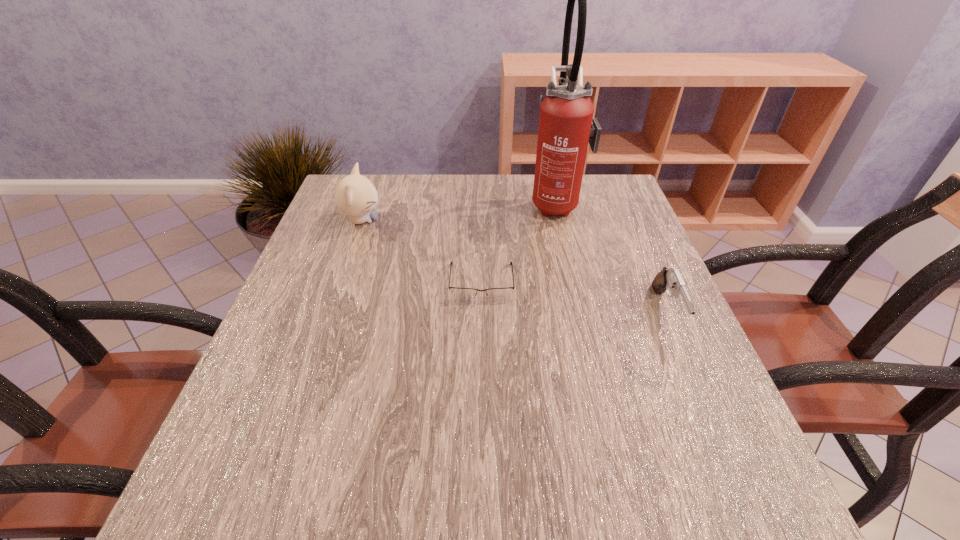
Find the location of `object situated at the far right corner`. object situated at the far right corner is located at coordinates (566, 125).

The width and height of the screenshot is (960, 540). I want to click on vacant space at the far edge of the desktop, so click(492, 180).

Locate an element on the screen. The width and height of the screenshot is (960, 540). free space at the near edge is located at coordinates (575, 501).

Where is `free space at the left edge`? The width and height of the screenshot is (960, 540). free space at the left edge is located at coordinates (335, 238).

The width and height of the screenshot is (960, 540). In the image, there is a desktop. Identify the location of vacant space at the right edge. (660, 270).

Locate an element on the screen. The image size is (960, 540). vacant area at the near left corner is located at coordinates (277, 485).

The width and height of the screenshot is (960, 540). I want to click on free space between the shortest object and the tallest object, so click(519, 242).

Image resolution: width=960 pixels, height=540 pixels. I want to click on vacant space that's between the shortest object and the kitten, so click(421, 251).

In order to click on free space between the tallest object and the third object from right to left in this screenshot , I will do `click(519, 242)`.

Locate an element on the screen. The width and height of the screenshot is (960, 540). vacant space that is in between the shortest object and the gun is located at coordinates (574, 297).